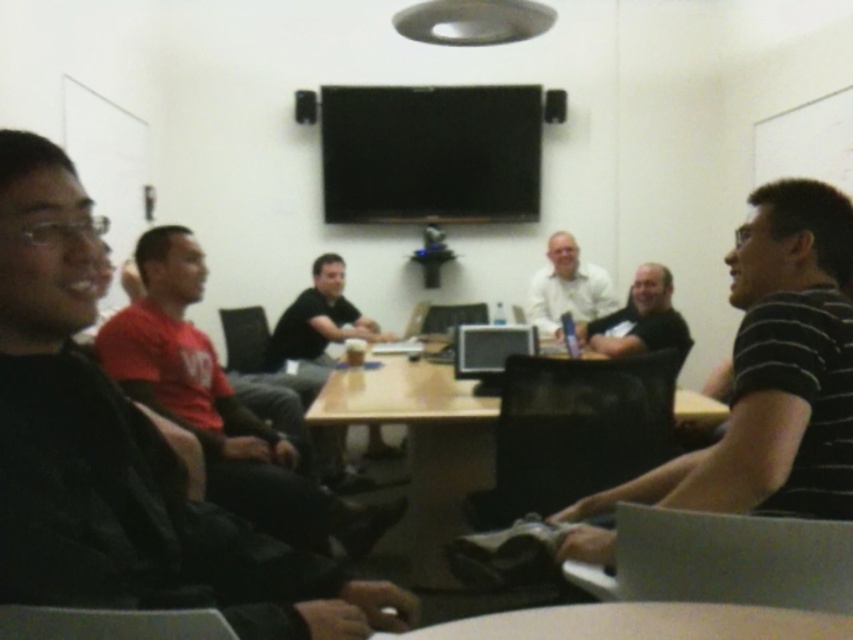
Is red matte shirt at left shorter than white glossy round table at lower center?

In fact, red matte shirt at left may be taller than white glossy round table at lower center.

Who is more forward, (166, 282) or (590, 634)?

Positioned in front is point (590, 634).

Image resolution: width=853 pixels, height=640 pixels. What are the coordinates of `red matte shirt at left` in the screenshot? It's located at (225, 406).

Who is lower down, black striped shirt at right or wooden table at center?

wooden table at center is lower down.

Is point (805, 272) more distant than point (445, 428)?

No, (805, 272) is closer to viewer.

Is point (753, 428) farther from viewer compared to point (329, 403)?

No, (753, 428) is in front of (329, 403).

This screenshot has height=640, width=853. What are the coordinates of `black striped shirt at right` in the screenshot? It's located at (775, 372).

Which is more to the left, red matte shirt at left or matte black shirt at center?

red matte shirt at left

What are the coordinates of `red matte shirt at left` in the screenshot? It's located at (225, 406).

Is point (186, 305) positioned before point (679, 333)?

Yes, it is.

Locate an element on the screen. This screenshot has width=853, height=640. red matte shirt at left is located at coordinates (225, 406).